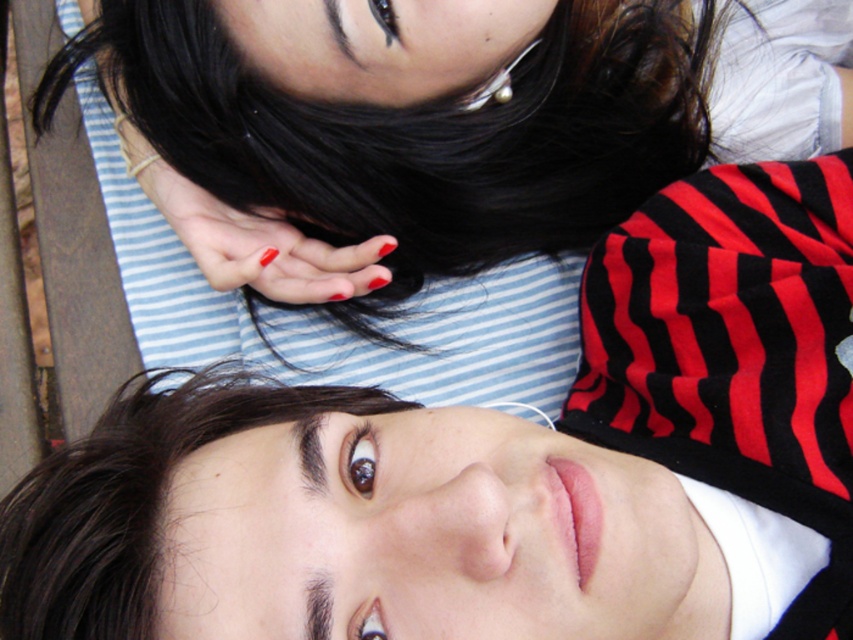
Can you confirm if dark brown shiny hair at upper center is thinner than glossy nail polish at center?

No, dark brown shiny hair at upper center is not thinner than glossy nail polish at center.

Is dark brown shiny hair at upper center to the left of glossy nail polish at center from the viewer's perspective?

Indeed, dark brown shiny hair at upper center is positioned on the left side of glossy nail polish at center.

Does point (129, 532) come farther from viewer compared to point (303, 296)?

No, (129, 532) is in front of (303, 296).

This screenshot has width=853, height=640. Identify the location of dark brown shiny hair at upper center. (129, 499).